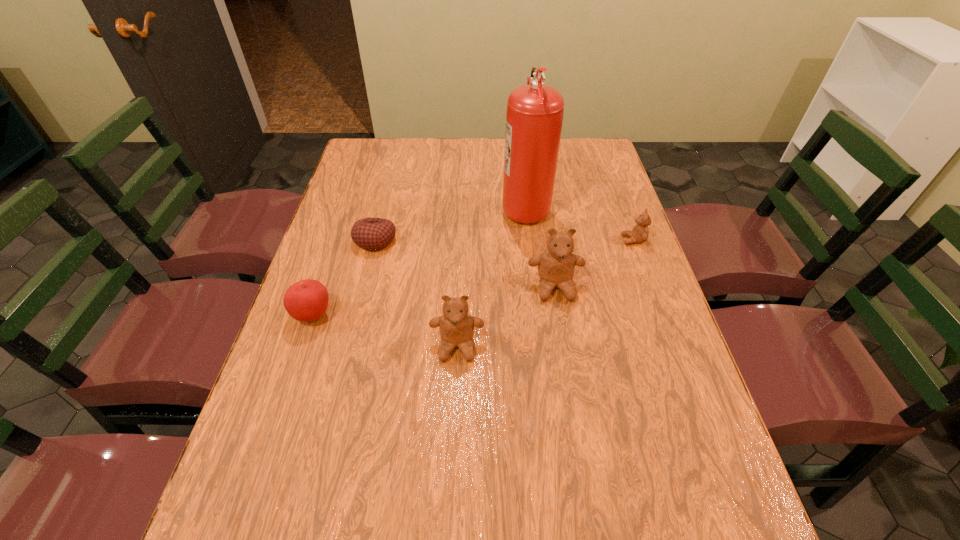
The image size is (960, 540). I want to click on vacant spot to place a teddy bear on the left, so click(331, 422).